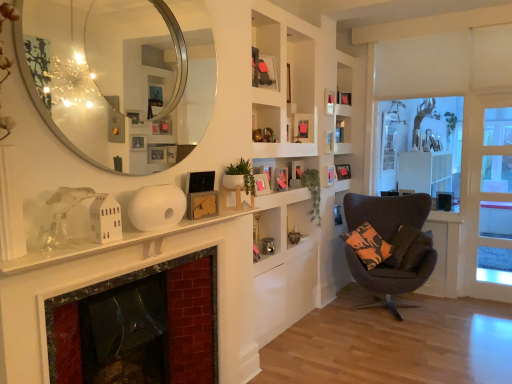
Identify the location of blank space situated above clear glass door at right (from a real-world perspective). The height and width of the screenshot is (384, 512). (500, 96).